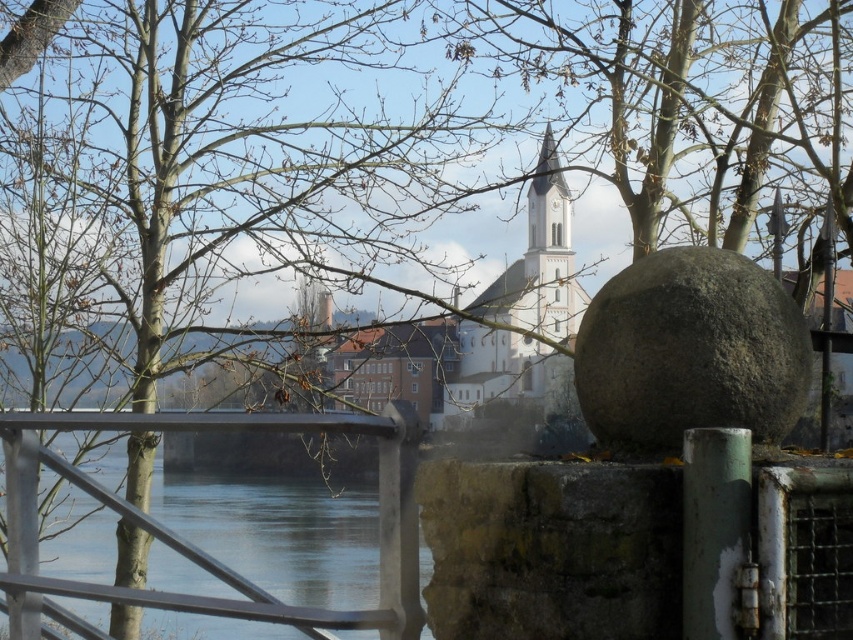
Question: From the image, what is the correct spatial relationship of brown leafless tree at upper left in relation to smooth concrete river at center?

Choices:
 (A) below
 (B) above

Answer: (B)

Question: Which point is closer to the camera taking this photo?

Choices:
 (A) (532, 257)
 (B) (189, 595)

Answer: (B)

Question: Can you confirm if brown leafless tree at upper left is bigger than smooth concrete river at center?

Choices:
 (A) no
 (B) yes

Answer: (B)

Question: Which object is positioned closest to the brown leafless tree at upper left?

Choices:
 (A) white stone tower at center
 (B) smooth concrete river at center
 (C) gray rough stone sphere at center

Answer: (B)

Question: Which object appears closest to the camera in this image?

Choices:
 (A) gray rough stone sphere at center
 (B) smooth concrete river at center
 (C) white stone tower at center

Answer: (B)

Question: Can you confirm if gray rough stone sphere at center is positioned above white stone tower at center?

Choices:
 (A) no
 (B) yes

Answer: (A)